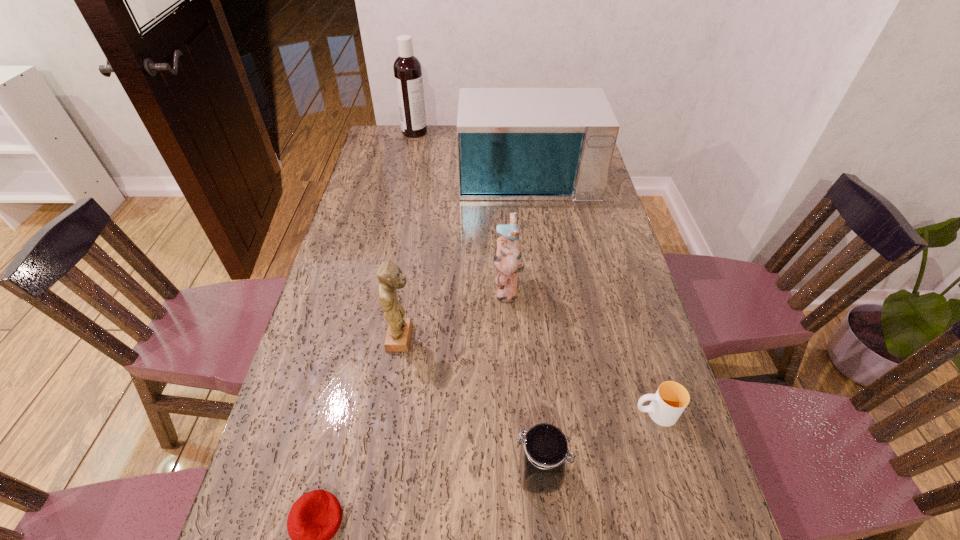
Identify the location of blank area located on the label side of the tallest object. The height and width of the screenshot is (540, 960). (439, 132).

You are a GUI agent. You are given a task and a screenshot of the screen. Output one action in this format:
    pyautogui.click(x=<x>, y=<y>)
    Task: Click on the vacant region located on the front-facing side of the sixth nearest object
    
    Given the screenshot: What is the action you would take?
    click(534, 220)

Find the location of `vacant area situated 0.100m on the front-facing side of the fourth farthest object`. vacant area situated 0.100m on the front-facing side of the fourth farthest object is located at coordinates (454, 338).

Identify the location of free spot located 0.110m on the front-facing side of the third farthest object. The width and height of the screenshot is (960, 540). (454, 287).

Where is `free space located on the front-facing side of the third farthest object`? Image resolution: width=960 pixels, height=540 pixels. free space located on the front-facing side of the third farthest object is located at coordinates click(371, 287).

Locate an element on the screen. This screenshot has height=540, width=960. vacant space located on the front-facing side of the third farthest object is located at coordinates tap(471, 287).

Identify the location of vacant area situated on the lid of the jar. (465, 474).

The image size is (960, 540). In order to click on free spot located 0.150m on the lid of the jar in this screenshot , I will do `click(440, 474)`.

The height and width of the screenshot is (540, 960). Find the location of `vacant space located 0.110m on the lid of the jar`. vacant space located 0.110m on the lid of the jar is located at coordinates (460, 474).

The image size is (960, 540). In order to click on vacant area situated 0.130m with the handle on the side of the second shortest object in this screenshot , I will do `click(576, 413)`.